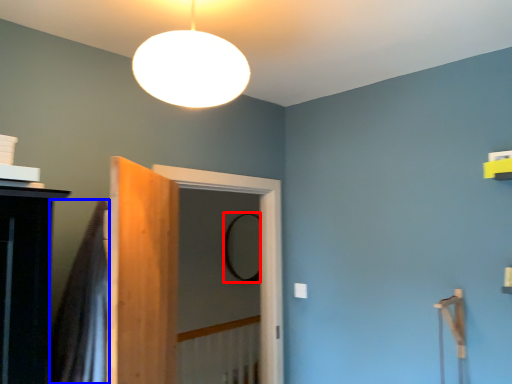
Question: Which point is further to the camera, mirror (highlighted by a red box) or shower curtain (highlighted by a blue box)?

Choices:
 (A) mirror
 (B) shower curtain

Answer: (A)